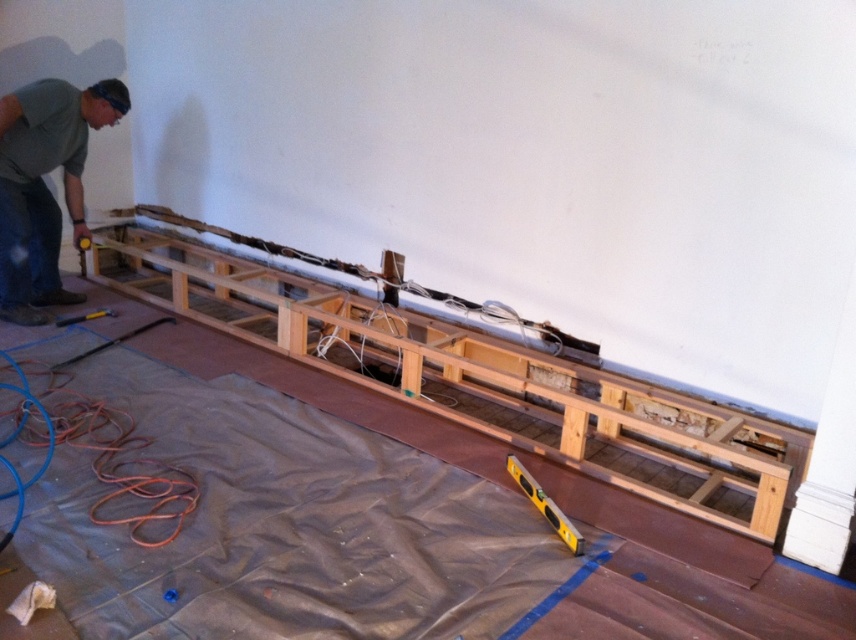
Can you confirm if yellow plastic level at center is shorter than yellow metallic level at lower center?

Incorrect, yellow plastic level at center's height does not fall short of yellow metallic level at lower center's.

This screenshot has width=856, height=640. Find the location of `yellow plastic level at center`. yellow plastic level at center is located at coordinates (545, 506).

Can you confirm if green matte shirt at left is positioned to the right of yellow plastic level at center?

Incorrect, green matte shirt at left is not on the right side of yellow plastic level at center.

Is point (3, 129) closer to viewer compared to point (510, 474)?

No, it is not.

Locate an element on the screen. The height and width of the screenshot is (640, 856). green matte shirt at left is located at coordinates point(45,186).

Is green matte shirt at left bigger than yellow metallic level at lower center?

Yes, green matte shirt at left is bigger than yellow metallic level at lower center.

Can you confirm if green matte shirt at left is positioned to the left of yellow metallic level at lower center?

Correct, you'll find green matte shirt at left to the left of yellow metallic level at lower center.

Does point (45, 212) come closer to viewer compared to point (108, 314)?

Yes.

Locate an element on the screen. The width and height of the screenshot is (856, 640). green matte shirt at left is located at coordinates (45, 186).